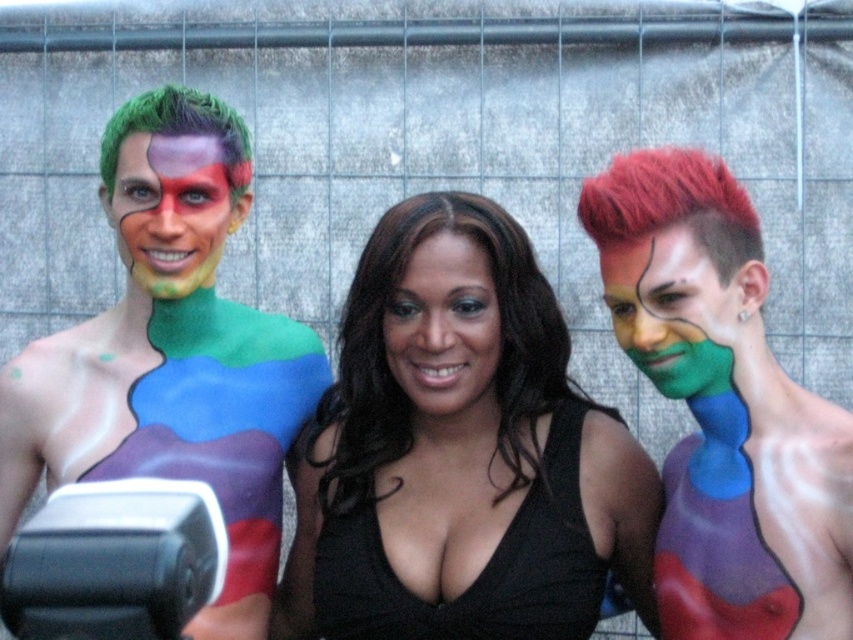
Is point (544, 572) more distant than point (671, 364)?

Yes, it is behind point (671, 364).

I want to click on black matte dress at center, so click(482, 570).

Is multicolored body paint at center shorter than green matte body paint at right?

In fact, multicolored body paint at center may be taller than green matte body paint at right.

Where is `multicolored body paint at center`? multicolored body paint at center is located at coordinates (171, 353).

Does shiny red hair at right have a larger size compared to multicolored body paint at left?

Yes.

Between point (703, 163) and point (213, 221), which one is positioned in front?

Point (703, 163) is in front.

Which is behind, point (775, 532) or point (204, 227)?

The point (204, 227) is behind.

You are a GUI agent. You are given a task and a screenshot of the screen. Output one action in this format:
    pyautogui.click(x=<x>, y=<y>)
    Task: Click on the shiny red hair at right
    The height and width of the screenshot is (640, 853).
    Given the screenshot: What is the action you would take?
    pyautogui.click(x=723, y=406)